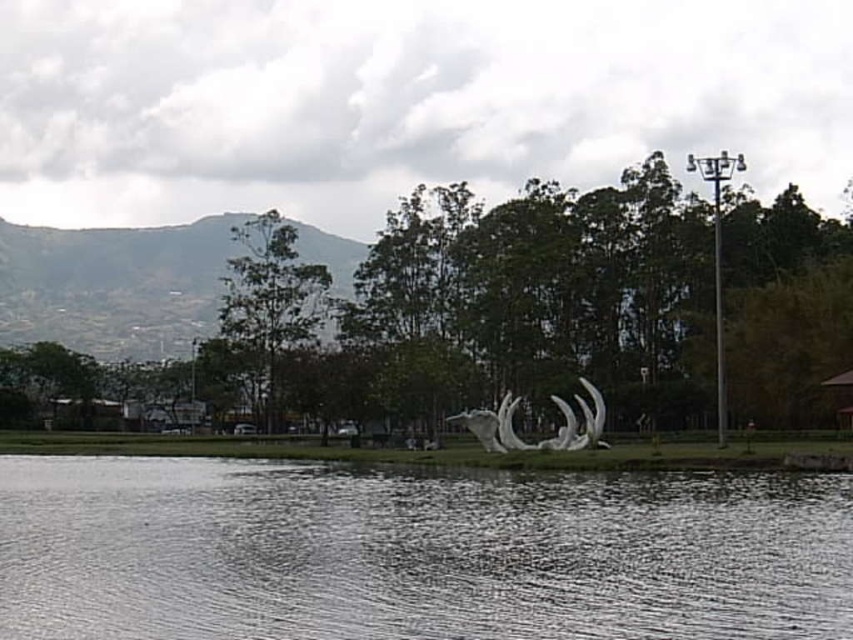
Question: Which object is farther from the camera taking this photo?

Choices:
 (A) clear water at center
 (B) white glossy sculpture at center

Answer: (B)

Question: Where is clear water at center located in relation to white glossy sculpture at center in the image?

Choices:
 (A) above
 (B) below

Answer: (B)

Question: Is clear water at center to the right of white glossy sculpture at center from the viewer's perspective?

Choices:
 (A) yes
 (B) no

Answer: (B)

Question: Among these points, which one is farthest from the camera?

Choices:
 (A) (665, 598)
 (B) (567, 445)

Answer: (B)

Question: Is clear water at center positioned at the back of white glossy sculpture at center?

Choices:
 (A) yes
 (B) no

Answer: (B)

Question: Which point is farther to the camera?

Choices:
 (A) white glossy sculpture at center
 (B) clear water at center

Answer: (A)